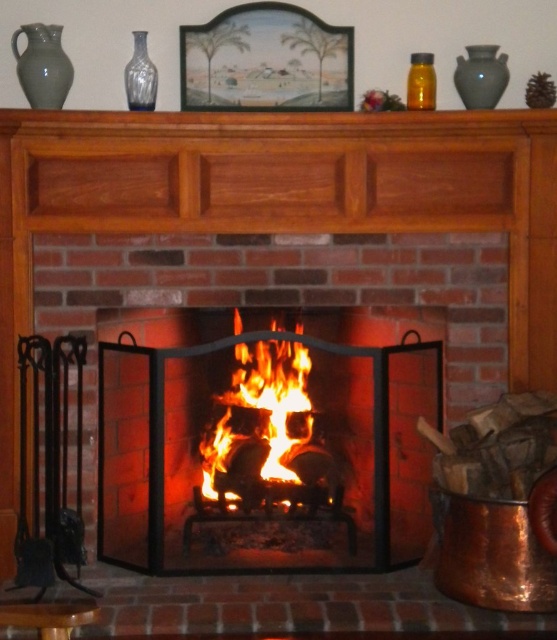
Question: Considering the real-world distances, which object is closest to the translucent amber glass at upper right?

Choices:
 (A) flaming wood at center
 (B) matte gray vase at upper right
 (C) translucent glass vase at upper center
 (D) matte gray vase at upper left

Answer: (B)

Question: Which point appears closest to the camera in this image?

Choices:
 (A) (427, 99)
 (B) (324, 426)
 (C) (505, 58)

Answer: (A)

Question: Can you confirm if black metal fireplace at center is thinner than matte gray vase at upper right?

Choices:
 (A) no
 (B) yes

Answer: (A)

Question: Where is flaming wood at center located in relation to matte gray vase at upper right in the image?

Choices:
 (A) above
 (B) below

Answer: (B)

Question: Can you confirm if flaming wood at center is positioned to the left of matte gray vase at upper right?

Choices:
 (A) yes
 (B) no

Answer: (A)

Question: Based on their relative distances, which object is farther from the translucent glass vase at upper center?

Choices:
 (A) matte gray vase at upper left
 (B) black metal fireplace at center
 (C) matte gray vase at upper right
 (D) translucent amber glass at upper right

Answer: (B)